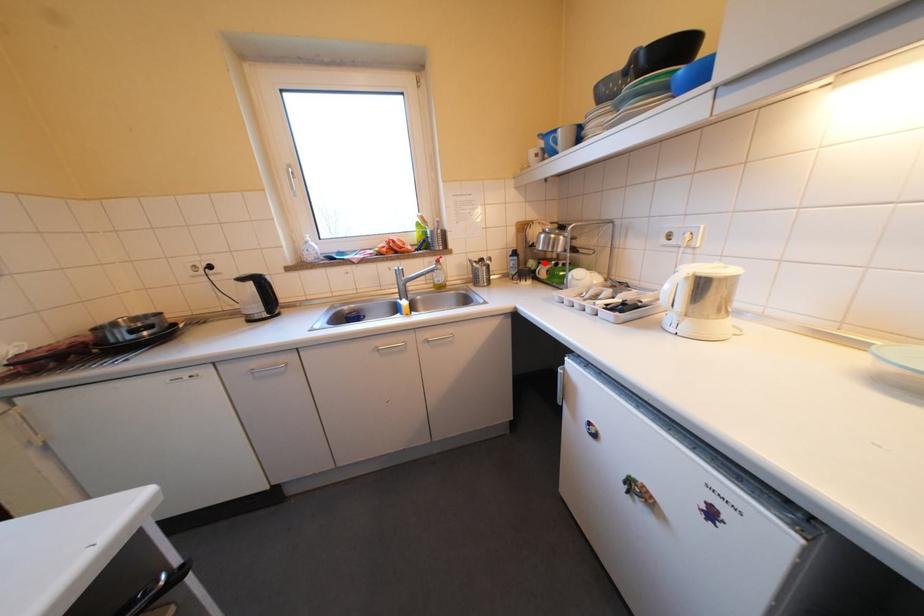
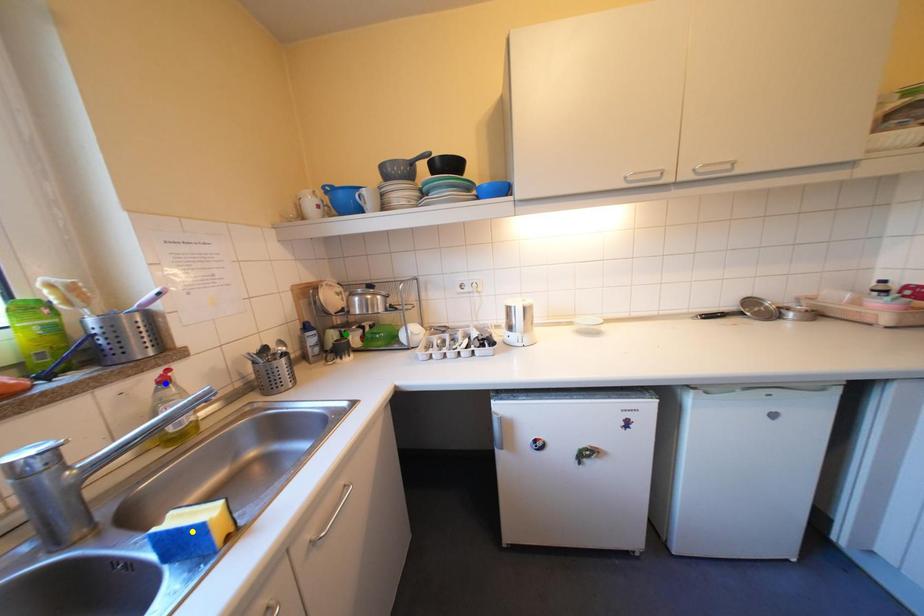
Question: I am providing you with two images of the same scene from different viewpoints. A red point is marked on the first image. You are given multiple points on the second image. Which point in image 2 is actually the same real-world point as the red point in image 1?

Choices:
 (A) yellow point
 (B) blue point
 (C) green point

Answer: (C)